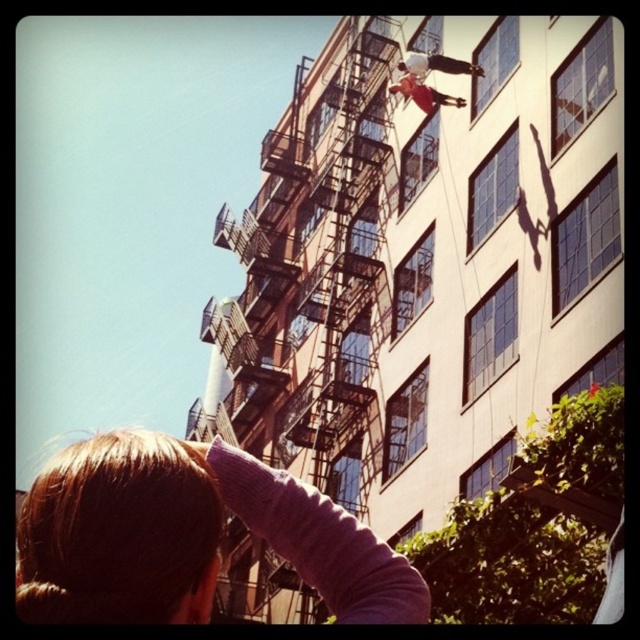
You are standing in front of the building and see two points marked on the fire escape. The first point is at coordinates point (376, 317) and the second is at point (336, 515). Which point is closer to you?

Point (376, 317) is closer to you because it is further to the viewer than point (336, 515).

You are standing in the urban scene and see the metallic fire escape at center and the blonde hair at lower left. Which object is positioned to the left of the other?

The metallic fire escape at center is to the left of blonde hair at lower left.